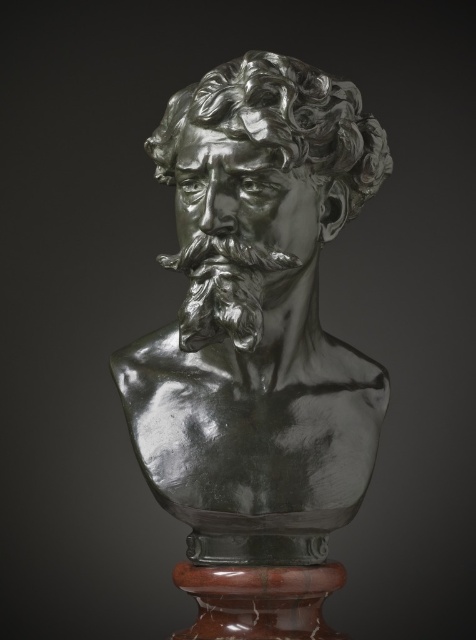
You are an art curator planning to display both the shiny bronze bust at center and the shiny silver bust at center in a narrow gallery space. Given their widths, which bust should you place closer to the entrance to ensure there is enough space for visitors to walk around it?

The shiny bronze bust at center has a larger width than the shiny silver bust at center. To accommodate the wider bust in the narrow space, place the shiny bronze bust at center closer to the entrance so visitors have enough space to walk around it.

You are an art curator arranging two bust sculptures in a gallery. You have a shiny bronze bust at center and a shiny silver bust at center. According to the image, which one is located to the right side?

The shiny bronze bust at center is positioned on the right side of the shiny silver bust at center.

You are an art conservator assessing the bronze sculpture. You need to determine if the shiny silver bust at center can fit through a narrow doorway that is only as wide as the shiny silver beard at center. Can it pass through?

The shiny silver bust at center might be wider than the shiny silver beard at center, so there is a possibility it cannot pass through the doorway if the doorway is only as wide as the beard.